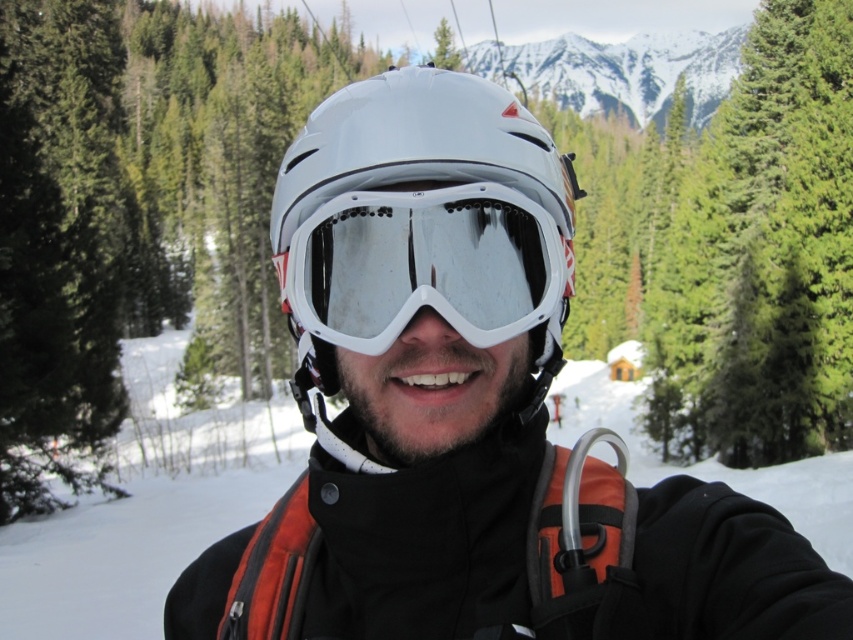
Question: Is white matte helmet at center below white matte/glossy goggles at center?

Choices:
 (A) yes
 (B) no

Answer: (B)

Question: Among these objects, which one is farthest from the camera?

Choices:
 (A) white matte/glossy goggles at center
 (B) white matte helmet at center

Answer: (A)

Question: Is white matte helmet at center bigger than white matte/glossy goggles at center?

Choices:
 (A) yes
 (B) no

Answer: (A)

Question: Does white matte helmet at center have a larger size compared to white matte/glossy goggles at center?

Choices:
 (A) no
 (B) yes

Answer: (B)